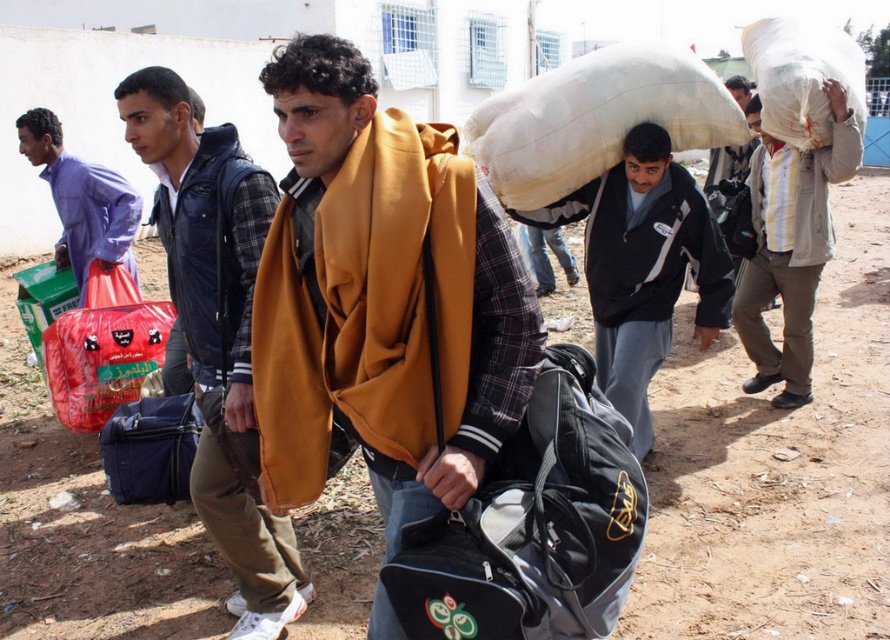
You are a humanitarian aid worker assessing the items carried by the displaced individuals. You need to determine which item can hold more supplies between the white woven sack at upper center and the red plastic bag at center. Which one would you choose?

The white woven sack at upper center has a larger size compared to the red plastic bag at center, so it can hold more supplies.

You are a photographer trying to capture the central figure in the foreground wearing a mustard yellow hoodie. You notice two points in the image labeled as point 1 at coordinates point (808, 221) and point 2 at coordinates point (89, 352). Which point is closer to your camera lens?

Point 1 at coordinates point (808, 221) is closer to the camera lens than point 2 at coordinates point (89, 352) because it is further to the camera.

You are a photographer trying to capture the white woven sack at upper center and the red plastic bag at center in a single frame. Based on their positions, which object will appear closer to the camera in the photo?

The white woven sack at upper center will appear closer to the camera because it is positioned in front of the red plastic bag at center.